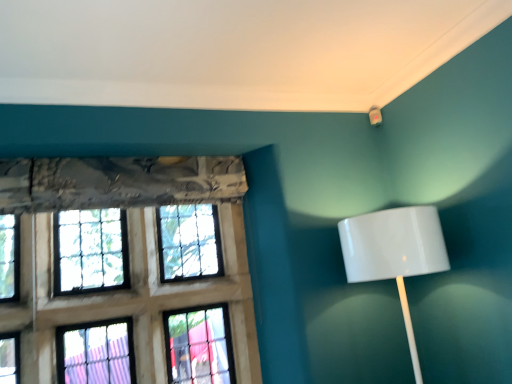
Question: Can you confirm if white glossy lampshade at right is positioned to the left of stained glass window at left?

Choices:
 (A) yes
 (B) no

Answer: (B)

Question: Does white glossy lampshade at right have a smaller size compared to stained glass window at left?

Choices:
 (A) no
 (B) yes

Answer: (B)

Question: Does white glossy lampshade at right have a greater width compared to stained glass window at left?

Choices:
 (A) yes
 (B) no

Answer: (A)

Question: Is white glossy lampshade at right bigger than stained glass window at left?

Choices:
 (A) no
 (B) yes

Answer: (A)

Question: Does white glossy lampshade at right have a greater height compared to stained glass window at left?

Choices:
 (A) no
 (B) yes

Answer: (A)

Question: Is white glossy lampshade at right positioned with its back to stained glass window at left?

Choices:
 (A) no
 (B) yes

Answer: (A)

Question: From the image's perspective, is stained glass window at left located beneath white glossy lampshade at right?

Choices:
 (A) no
 (B) yes

Answer: (B)

Question: From the image's perspective, does stained glass window at left appear higher than white glossy lampshade at right?

Choices:
 (A) no
 (B) yes

Answer: (A)

Question: Can you confirm if stained glass window at left is positioned to the left of white glossy lampshade at right?

Choices:
 (A) yes
 (B) no

Answer: (A)

Question: Considering the relative positions of stained glass window at left and white glossy lampshade at right in the image provided, is stained glass window at left behind white glossy lampshade at right?

Choices:
 (A) no
 (B) yes

Answer: (B)

Question: Considering the relative sizes of stained glass window at left and white glossy lampshade at right in the image provided, is stained glass window at left wider than white glossy lampshade at right?

Choices:
 (A) yes
 (B) no

Answer: (B)

Question: Is stained glass window at left looking in the opposite direction of white glossy lampshade at right?

Choices:
 (A) no
 (B) yes

Answer: (A)

Question: Is stained glass window at left taller or shorter than white glossy lampshade at right?

Choices:
 (A) tall
 (B) short

Answer: (A)